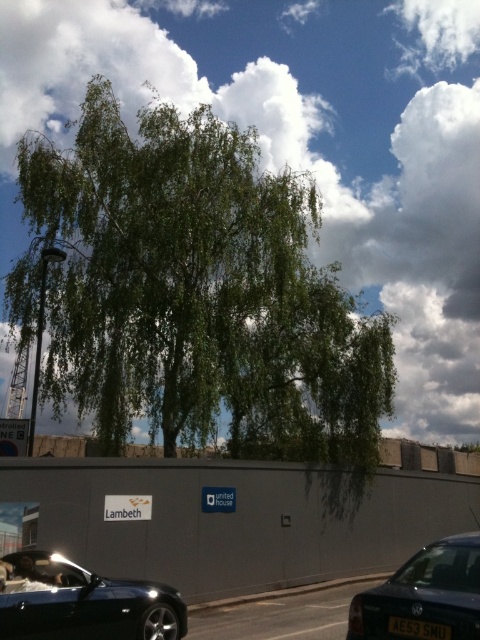
You are a photographer trying to capture a photo of the shiny black car at lower left without the green leafy tree at center blocking it. Based on their sizes, is this possible?

The green leafy tree at center might be wider than the shiny black car at lower left, so there is a possibility that the tree could block the car in the photo if they are positioned closely. To avoid obstruction, repositioning the camera angle or moving the car might be necessary.

You are a photographer planning to capture the green leafy tree at center and the shiny black car at lower left in a single frame. Given that the tree is larger, how might its size affect the composition of your photo?

The green leafy tree at center is bigger than the shiny black car at lower left, so it will dominate the composition, drawing more attention compared to the car.

You are standing in a parking lot and see the green leafy tree at center and the matte black car at lower right. Which object is closer to the left side of the parking lot?

The green leafy tree at center is closer to the left side of the parking lot because it is positioned to the left of the matte black car at lower right.